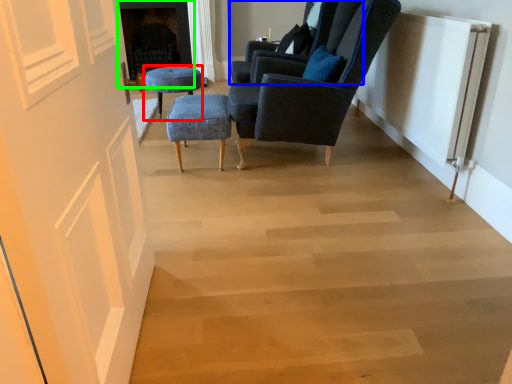
Question: Based on their relative distances, which object is farther from stool (highlighted by a red box)? Choose from chair (highlighted by a blue box) and fireplace (highlighted by a green box).

Choices:
 (A) chair
 (B) fireplace

Answer: (B)